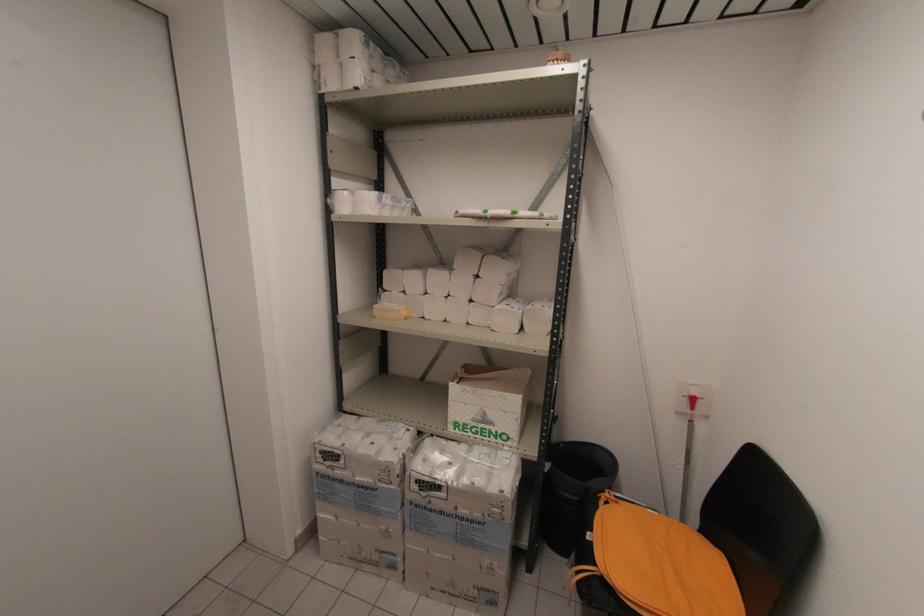
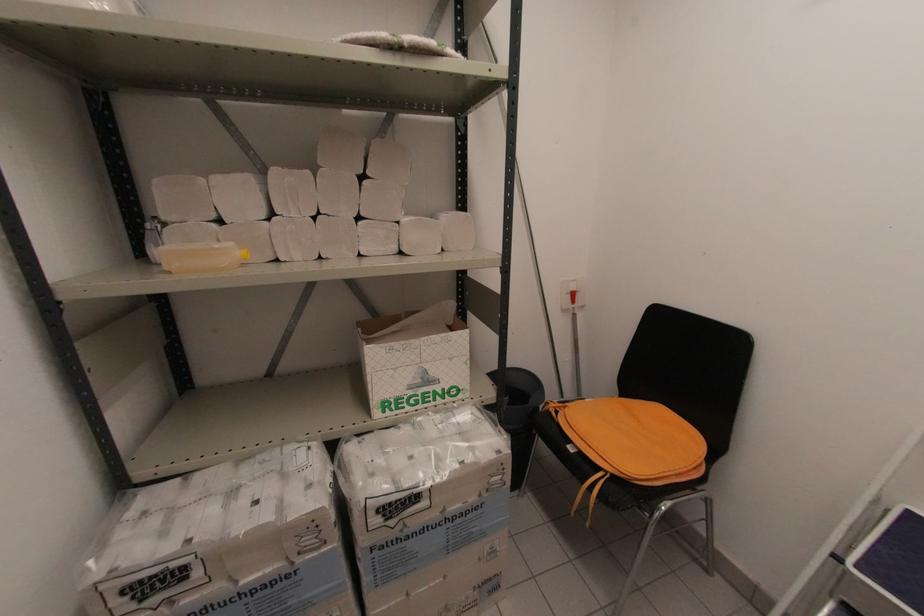
Question: How did the camera likely rotate?

Choices:
 (A) Left
 (B) Right
 (C) Up
 (D) Down

Answer: (B)